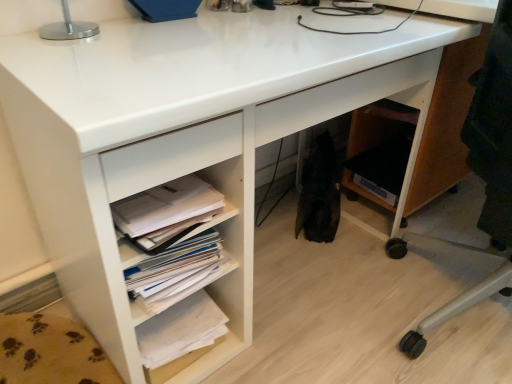
At what (x,y) coordinates should I click in order to perform the action: click on free space in front of silver metallic table lamp at upper left. Please return your answer as a coordinate pair (x, y). The width and height of the screenshot is (512, 384). Looking at the image, I should click on (56, 58).